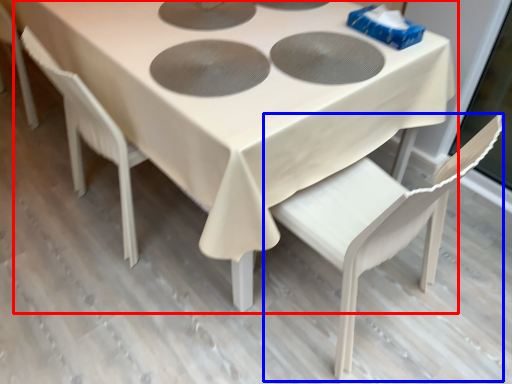
Question: Which of the following is the farthest to the observer, table (highlighted by a red box) or chair (highlighted by a blue box)?

Choices:
 (A) table
 (B) chair

Answer: (A)